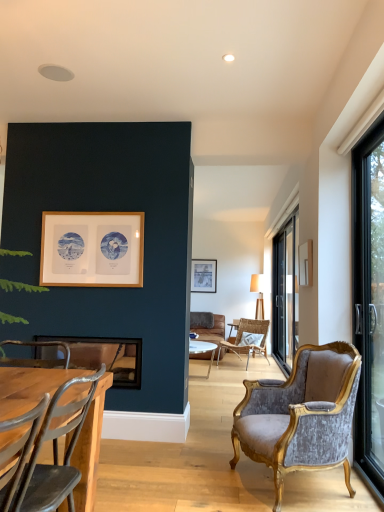
Question: Is black glass screen door at right closer to camera compared to matte wooden picture frame at center, the 3th picture frame positioned from the front?

Choices:
 (A) no
 (B) yes

Answer: (B)

Question: Is black glass screen door at right positioned far away from matte wooden picture frame at center, the 3th picture frame positioned from the front?

Choices:
 (A) no
 (B) yes

Answer: (B)

Question: From the image's perspective, would you say black glass screen door at right is shown under matte wooden picture frame at center, placed as the second picture frame when sorted from bottom to top?

Choices:
 (A) no
 (B) yes

Answer: (B)

Question: Is black glass screen door at right thinner than matte wooden picture frame at center, the 3th picture frame positioned from the front?

Choices:
 (A) no
 (B) yes

Answer: (A)

Question: Is black glass screen door at right in contact with matte wooden picture frame at center, placed as the second picture frame when sorted from bottom to top?

Choices:
 (A) no
 (B) yes

Answer: (A)

Question: From the image's perspective, relative to metallic gray chair at lower left, the 1th chair viewed from the left, is velvet/gold armchair at right, marked as the second chair in a right-to-left arrangement, above or below?

Choices:
 (A) above
 (B) below

Answer: (B)

Question: Considering the positions of velvet/gold armchair at right, placed as the 2th chair when sorted from front to back, and metallic gray chair at lower left, which is counted as the 1th chair, starting from the front, in the image, is velvet/gold armchair at right, placed as the 2th chair when sorted from front to back, wider or thinner than metallic gray chair at lower left, which is counted as the 1th chair, starting from the front,?

Choices:
 (A) wide
 (B) thin

Answer: (A)

Question: Is velvet/gold armchair at right, placed as the 2th chair when sorted from front to back, taller or shorter than metallic gray chair at lower left, which is the third chair in back-to-front order?

Choices:
 (A) short
 (B) tall

Answer: (B)

Question: Is point (263, 387) positioned closer to the camera than point (21, 379)?

Choices:
 (A) closer
 (B) farther

Answer: (B)

Question: Would you say woven rattan chair at center, which is counted as the 1th chair, starting from the right, is inside or outside black glass door at right, which appears as the first window when viewed from the left?

Choices:
 (A) inside
 (B) outside

Answer: (B)

Question: Is woven rattan chair at center, which is counted as the 1th chair, starting from the right, bigger or smaller than black glass door at right, which appears as the first window when viewed from the left?

Choices:
 (A) big
 (B) small

Answer: (A)

Question: Is woven rattan chair at center, which is counted as the 1th chair, starting from the right, taller or shorter than black glass door at right, the 1th window viewed from the front?

Choices:
 (A) short
 (B) tall

Answer: (A)

Question: Relative to black glass door at right, acting as the 2th window starting from the back, is woven rattan chair at center, placed as the third chair when sorted from front to back, in front or behind?

Choices:
 (A) behind
 (B) front

Answer: (A)

Question: Is point (286, 225) positioned closer to the camera than point (87, 211)?

Choices:
 (A) closer
 (B) farther

Answer: (B)

Question: From a real-world perspective, is black glass door at right, the 1th window in the right-to-left sequence, positioned above or below wooden frame at upper left, the 2th picture frame when ordered from back to front?

Choices:
 (A) above
 (B) below

Answer: (B)